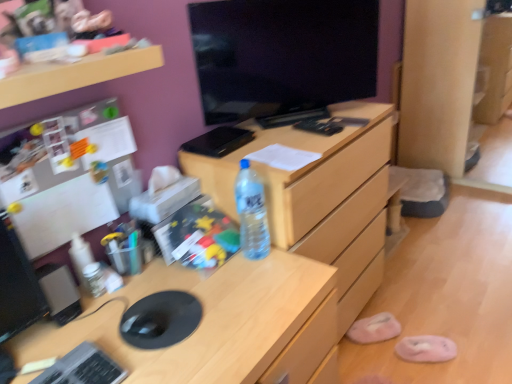
Question: Is silver metallic keyboard at lower left taller than pink fabric slipper at lower right, which appears as the 1th slipper when viewed from the back?

Choices:
 (A) no
 (B) yes

Answer: (A)

Question: Is silver metallic keyboard at lower left positioned before pink fabric slipper at lower right, arranged as the first slipper when viewed from the left?

Choices:
 (A) no
 (B) yes

Answer: (B)

Question: Is silver metallic keyboard at lower left outside pink fabric slipper at lower right, which is counted as the 2th slipper, starting from the right?

Choices:
 (A) yes
 (B) no

Answer: (A)

Question: Considering the relative positions of silver metallic keyboard at lower left and pink fabric slipper at lower right, which appears as the 1th slipper when viewed from the back, in the image provided, is silver metallic keyboard at lower left to the left of pink fabric slipper at lower right, which appears as the 1th slipper when viewed from the back, from the viewer's perspective?

Choices:
 (A) no
 (B) yes

Answer: (B)

Question: Is silver metallic keyboard at lower left placed right next to pink fabric slipper at lower right, which appears as the 1th slipper when viewed from the back?

Choices:
 (A) yes
 (B) no

Answer: (B)

Question: From the image's perspective, is silver metallic keyboard at lower left on top of pink fabric slipper at lower right, which appears as the 1th slipper when viewed from the back?

Choices:
 (A) no
 (B) yes

Answer: (B)

Question: From the image's perspective, does translucent plastic water bottle at center appear lower than wooden desk at center?

Choices:
 (A) no
 (B) yes

Answer: (A)

Question: Is translucent plastic water bottle at center located outside wooden desk at center?

Choices:
 (A) no
 (B) yes

Answer: (B)

Question: From a real-world perspective, is translucent plastic water bottle at center positioned under wooden desk at center based on gravity?

Choices:
 (A) no
 (B) yes

Answer: (A)

Question: Is translucent plastic water bottle at center thinner than wooden desk at center?

Choices:
 (A) no
 (B) yes

Answer: (B)

Question: Is translucent plastic water bottle at center at the right side of wooden desk at center?

Choices:
 (A) no
 (B) yes

Answer: (B)

Question: Is translucent plastic water bottle at center far away from wooden desk at center?

Choices:
 (A) no
 (B) yes

Answer: (A)

Question: Is the position of pink fabric slipper at lower right, arranged as the first slipper when viewed from the left, more distant than that of pink fuzzy slipper at lower right, the first slipper in the right-to-left sequence?

Choices:
 (A) no
 (B) yes

Answer: (B)